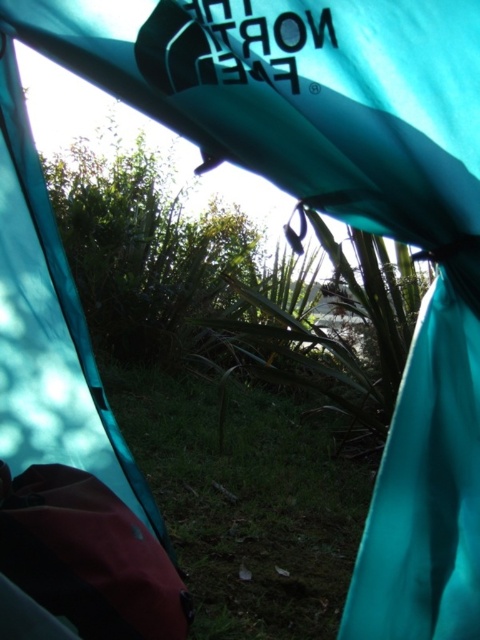
Does teal fabric tent at upper left have a smaller size compared to maroon synthetic sleeping bag at lower left?

No, teal fabric tent at upper left is not smaller than maroon synthetic sleeping bag at lower left.

Consider the image. Measure the distance between teal fabric tent at upper left and camera.

teal fabric tent at upper left is 21.73 inches from camera.

The width and height of the screenshot is (480, 640). Find the location of `teal fabric tent at upper left`. teal fabric tent at upper left is located at coordinates (79, 339).

Which of these two, teal fabric tent at upper left or green grass at center, stands taller?

With more height is teal fabric tent at upper left.

What do you see at coordinates (79, 339) in the screenshot?
I see `teal fabric tent at upper left` at bounding box center [79, 339].

Where is `teal fabric tent at upper left`? The image size is (480, 640). teal fabric tent at upper left is located at coordinates (79, 339).

Does green grass at center have a larger size compared to maroon synthetic sleeping bag at lower left?

Yes.

Is green grass at center wider than maroon synthetic sleeping bag at lower left?

Correct, the width of green grass at center exceeds that of maroon synthetic sleeping bag at lower left.

At what (x,y) coordinates should I click in order to perform the action: click on green grass at center. Please return your answer as a coordinate pair (x, y). This screenshot has width=480, height=640. Looking at the image, I should click on (245, 500).

Locate an element on the screen. green grass at center is located at coordinates (245, 500).